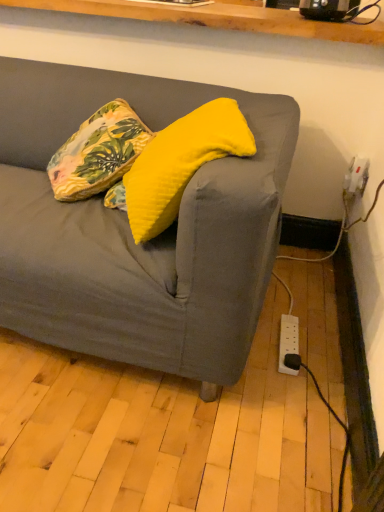
Question: Looking at the image, does floral fabric pillow at upper left, which is counted as the first pillow, starting from the left, seem bigger or smaller compared to yellow soft cushion at center, which is the first pillow in right-to-left order?

Choices:
 (A) big
 (B) small

Answer: (B)

Question: In the image, is floral fabric pillow at upper left, the 2th pillow from the right, positioned in front of or behind yellow soft cushion at center, which appears as the second pillow when viewed from the left?

Choices:
 (A) behind
 (B) front

Answer: (A)

Question: From a real-world perspective, is floral fabric pillow at upper left, the 2th pillow from the right, positioned above or below yellow soft cushion at center, which is the first pillow in right-to-left order?

Choices:
 (A) below
 (B) above

Answer: (A)

Question: Is yellow soft cushion at center, which is the first pillow in right-to-left order, taller or shorter than floral fabric pillow at upper left, the 2th pillow from the right?

Choices:
 (A) tall
 (B) short

Answer: (A)

Question: Considering the positions of point (162, 208) and point (97, 115), is point (162, 208) closer or farther from the camera than point (97, 115)?

Choices:
 (A) farther
 (B) closer

Answer: (B)

Question: From a real-world perspective, relative to floral fabric pillow at upper left, the 2th pillow from the right, is yellow soft cushion at center, which is the first pillow in right-to-left order, vertically above or below?

Choices:
 (A) above
 (B) below

Answer: (A)

Question: Based on their positions, is yellow soft cushion at center, which is the first pillow in right-to-left order, located to the left or right of floral fabric pillow at upper left, which is counted as the first pillow, starting from the left?

Choices:
 (A) left
 (B) right

Answer: (B)